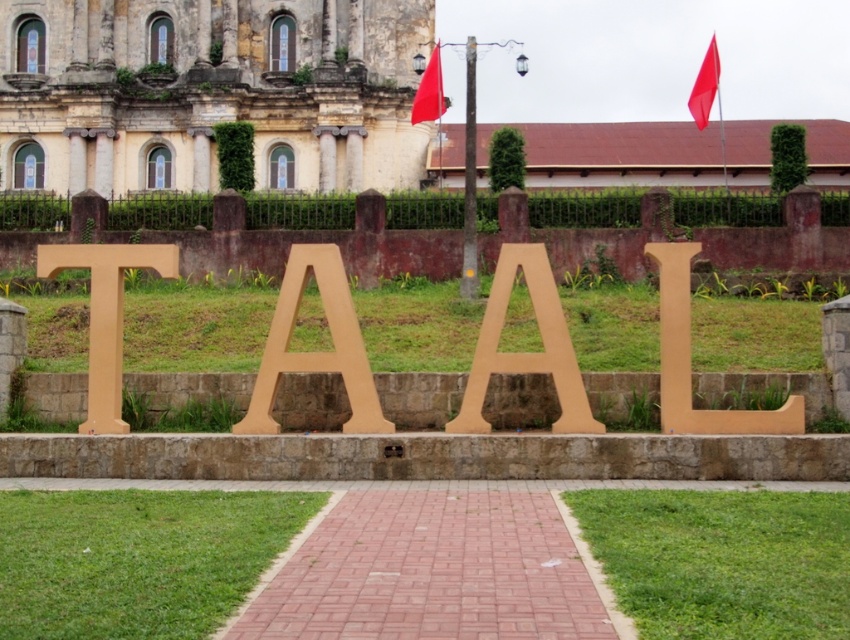
Question: Where is matte gold letter a at center located in relation to matte wood letter l at center in the image?

Choices:
 (A) below
 (B) above

Answer: (B)

Question: Which object appears farthest from the camera in this image?

Choices:
 (A) red brick path at center
 (B) matte cardboard letter a at center
 (C) stone wall at upper center

Answer: (C)

Question: Which of the following is the farthest from the observer?

Choices:
 (A) (513, 260)
 (B) (68, 256)

Answer: (B)

Question: In this image, where is matte gold letter a at center located relative to red fabric flag at upper center?

Choices:
 (A) below
 (B) above

Answer: (A)

Question: Is the position of red brick path at center more distant than that of red fabric flag at upper center?

Choices:
 (A) no
 (B) yes

Answer: (A)

Question: Which of the following is the farthest from the observer?

Choices:
 (A) red fabric flag at upper center
 (B) matte gold letter t at left

Answer: (A)